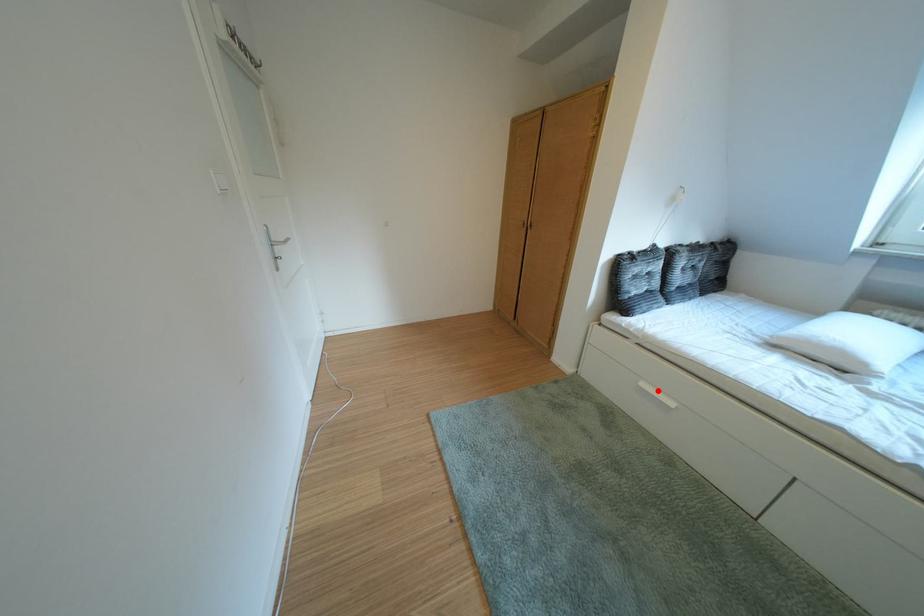
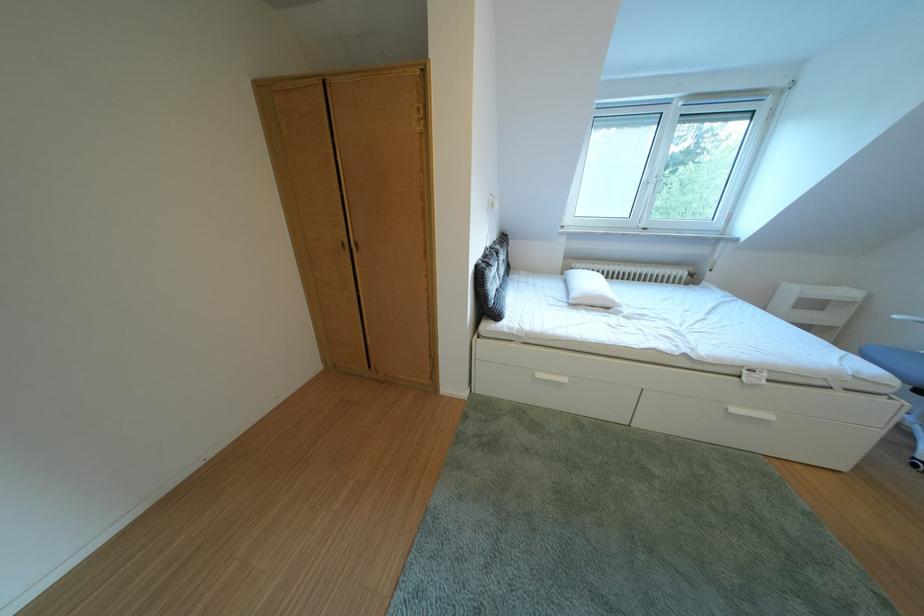
In the second image, find the point that corresponds to the highlighted location in the first image.

(553, 381)